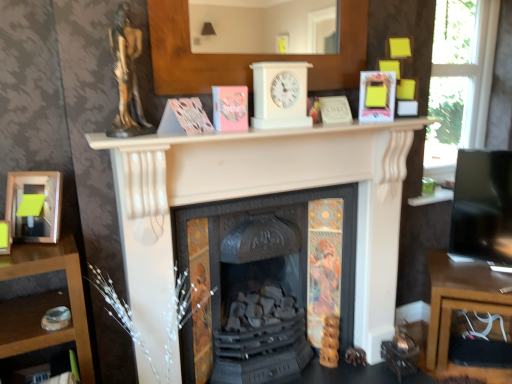
Question: Does transparent glass window at upper right have a larger size compared to pink matte paper at center, arranged as the 4th paperback book when viewed from the right?

Choices:
 (A) yes
 (B) no

Answer: (A)

Question: Does transparent glass window at upper right lie behind pink matte paper at center, arranged as the 4th paperback book when viewed from the right?

Choices:
 (A) no
 (B) yes

Answer: (B)

Question: From a real-world perspective, is transparent glass window at upper right positioned over pink matte paper at center, arranged as the 4th paperback book when viewed from the right, based on gravity?

Choices:
 (A) no
 (B) yes

Answer: (B)

Question: Is transparent glass window at upper right taller than pink matte paper at center, arranged as the 4th paperback book when viewed from the right?

Choices:
 (A) yes
 (B) no

Answer: (A)

Question: From the image's perspective, would you say transparent glass window at upper right is positioned over pink matte paper at center, positioned as the 1th paperback book in left-to-right order?

Choices:
 (A) yes
 (B) no

Answer: (A)

Question: From a real-world perspective, relative to pink matte paper at center, positioned as the third paperback book in right-to-left order, is white matte fireplace at center, which is counted as the 2th fireplace, starting from the back, vertically above or below?

Choices:
 (A) above
 (B) below

Answer: (B)

Question: Looking at their shapes, would you say white matte fireplace at center, the 1th fireplace viewed from the front, is wider or thinner than pink matte paper at center, positioned as the third paperback book in right-to-left order?

Choices:
 (A) thin
 (B) wide

Answer: (B)

Question: From the image's perspective, is white matte fireplace at center, the 1th fireplace viewed from the front, above or below pink matte paper at center, positioned as the third paperback book in right-to-left order?

Choices:
 (A) above
 (B) below

Answer: (B)

Question: Is point [144, 221] positioned closer to the camera than point [230, 86]?

Choices:
 (A) closer
 (B) farther

Answer: (A)

Question: Relative to gold metallic statue at upper left, is hardcover book at upper right, positioned as the 1th paperback book in right-to-left order, in front or behind?

Choices:
 (A) behind
 (B) front

Answer: (A)

Question: Would you say hardcover book at upper right, positioned as the 1th paperback book in right-to-left order, is inside or outside gold metallic statue at upper left?

Choices:
 (A) inside
 (B) outside

Answer: (B)

Question: Visually, is hardcover book at upper right, the fourth paperback book from the left, positioned to the left or to the right of gold metallic statue at upper left?

Choices:
 (A) left
 (B) right

Answer: (B)

Question: Is hardcover book at upper right, positioned as the 1th paperback book in right-to-left order, bigger or smaller than gold metallic statue at upper left?

Choices:
 (A) big
 (B) small

Answer: (B)

Question: From the image's perspective, is wooden desk at lower right positioned above or below hardcover book at upper right, positioned as the 1th paperback book in right-to-left order?

Choices:
 (A) below
 (B) above

Answer: (A)

Question: From their relative heights in the image, would you say wooden desk at lower right is taller or shorter than hardcover book at upper right, the fourth paperback book from the left?

Choices:
 (A) short
 (B) tall

Answer: (B)